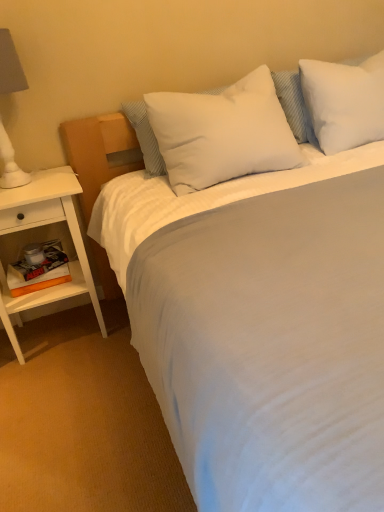
Measure the distance between white soft pillow at center, marked as the second pillow in a right-to-left arrangement, and camera.

4.92 feet.

What do you see at coordinates (44, 225) in the screenshot? The image size is (384, 512). I see `white wood nightstand at left` at bounding box center [44, 225].

In order to face white wood nightstand at left, should I rotate leftwards or rightwards?

Turn left approximately 19.790 degrees to face it.

You are a GUI agent. You are given a task and a screenshot of the screen. Output one action in this format:
    pyautogui.click(x=<x>, y=<y>)
    Task: Click on the orange matte book at left
    
    Given the screenshot: What is the action you would take?
    pos(39,271)

How much space does white soft pillow at upper right, which is the second pillow from left to right, occupy vertically?

14.94 inches.

Locate an element on the screen. The image size is (384, 512). white matte lampshade at left is located at coordinates (10, 66).

Can you confirm if white soft pillow at upper right, the 1th pillow from the right, is positioned to the right of white soft pillow at center, arranged as the first pillow when viewed from the left?

Indeed, white soft pillow at upper right, the 1th pillow from the right, is positioned on the right side of white soft pillow at center, arranged as the first pillow when viewed from the left.

Is white soft pillow at upper right, the 1th pillow from the right, positioned with its back to white soft pillow at center, arranged as the first pillow when viewed from the left?

white soft pillow at upper right, the 1th pillow from the right, does not have its back to white soft pillow at center, arranged as the first pillow when viewed from the left.

Where is `pillow behind the white soft pillow at center, arranged as the first pillow when viewed from the left`? pillow behind the white soft pillow at center, arranged as the first pillow when viewed from the left is located at coordinates (344, 102).

Considering the relative sizes of white wood nightstand at left and white soft pillow at center, marked as the second pillow in a right-to-left arrangement, in the image provided, is white wood nightstand at left smaller than white soft pillow at center, marked as the second pillow in a right-to-left arrangement,?

No, white wood nightstand at left is not smaller than white soft pillow at center, marked as the second pillow in a right-to-left arrangement.

Is white wood nightstand at left positioned far away from white soft pillow at center, marked as the second pillow in a right-to-left arrangement?

They are positioned close to each other.

Between point (53, 294) and point (245, 172), which one is positioned behind?

The point (53, 294) is behind.

Based on the photo, is white wood nightstand at left thinner than white soft pillow at center, arranged as the first pillow when viewed from the left?

No.

Considering the relative sizes of white wood nightstand at left and white soft pillow at upper right, the 1th pillow from the right, in the image provided, is white wood nightstand at left bigger than white soft pillow at upper right, the 1th pillow from the right,?

Indeed, white wood nightstand at left has a larger size compared to white soft pillow at upper right, the 1th pillow from the right.

Could you measure the distance between white wood nightstand at left and white soft pillow at upper right, the 1th pillow from the right?

white wood nightstand at left and white soft pillow at upper right, the 1th pillow from the right, are 3.79 feet apart.

Is white wood nightstand at left behind white soft pillow at upper right, which is the second pillow from left to right?

No, white wood nightstand at left is closer to the viewer.

Who is smaller, white matte lampshade at left or orange matte book at left?

Smaller between the two is orange matte book at left.

How much distance is there between white matte lampshade at left and orange matte book at left?

white matte lampshade at left and orange matte book at left are 17.57 inches apart from each other.

Considering the positions of objects white matte lampshade at left and orange matte book at left in the image provided, who is more to the right, white matte lampshade at left or orange matte book at left?

orange matte book at left is more to the right.

This screenshot has width=384, height=512. Find the location of `bedside lamp positioned vertically above the orange matte book at left (from a real-world perspective)`. bedside lamp positioned vertically above the orange matte book at left (from a real-world perspective) is located at coordinates (10, 66).

Is white soft pillow at center, marked as the second pillow in a right-to-left arrangement, at the back of orange matte book at left?

orange matte book at left does not have its back to white soft pillow at center, marked as the second pillow in a right-to-left arrangement.

Considering the positions of objects orange matte book at left and white soft pillow at center, arranged as the first pillow when viewed from the left, in the image provided, who is more to the left, orange matte book at left or white soft pillow at center, arranged as the first pillow when viewed from the left,?

orange matte book at left.

Based on the photo, can you confirm if orange matte book at left is wider than white soft pillow at center, arranged as the first pillow when viewed from the left?

No.

Considering the sizes of objects orange matte book at left and white matte lampshade at left in the image provided, who is thinner, orange matte book at left or white matte lampshade at left?

orange matte book at left is thinner.

How many degrees apart are the facing directions of orange matte book at left and white matte lampshade at left?

There is a 2.19-degree angle between the facing directions of orange matte book at left and white matte lampshade at left.

In order to click on book below the white matte lampshade at left (from a real-world perspective) in this screenshot , I will do `click(39, 271)`.

How much distance is there between orange matte book at left and white wood nightstand at left?

They are 6.05 inches apart.

Is orange matte book at left aimed at white wood nightstand at left?

Yes, orange matte book at left is oriented towards white wood nightstand at left.

Can you confirm if orange matte book at left is bigger than white wood nightstand at left?

→ No, orange matte book at left is not bigger than white wood nightstand at left.

Based on the photo, based on their positions, is orange matte book at left located to the left or right of white wood nightstand at left?

orange matte book at left is positioned on white wood nightstand at left's left side.

The width and height of the screenshot is (384, 512). I want to click on pillow in front of the white soft pillow at upper right, the 1th pillow from the right, so click(222, 133).

This screenshot has width=384, height=512. I want to click on nightstand below the white soft pillow at center, marked as the second pillow in a right-to-left arrangement (from the image's perspective), so click(x=44, y=225).

Based on their spatial positions, is white matte lampshade at left or white soft pillow at upper right, the 1th pillow from the right, closer to white wood nightstand at left?

white matte lampshade at left is closer to white wood nightstand at left.

From the image, which object appears to be farther from white soft pillow at upper right, which is the second pillow from left to right, orange matte book at left or white soft pillow at center, arranged as the first pillow when viewed from the left?

orange matte book at left is positioned further to the anchor white soft pillow at upper right, which is the second pillow from left to right.

From the image, which object appears to be farther from orange matte book at left, white wood nightstand at left or white matte lampshade at left?

white matte lampshade at left is positioned further to the anchor orange matte book at left.

Which object lies further to the anchor point white matte lampshade at left, white soft pillow at center, arranged as the first pillow when viewed from the left, or white wood nightstand at left?

white soft pillow at center, arranged as the first pillow when viewed from the left, lies further to white matte lampshade at left than the other object.

From the image, which object appears to be farther from white soft pillow at upper right, which is the second pillow from left to right, white wood nightstand at left or white matte lampshade at left?

white matte lampshade at left is further to white soft pillow at upper right, which is the second pillow from left to right.

Estimate the real-world distances between objects in this image. Which object is closer to white wood nightstand at left, white soft pillow at center, marked as the second pillow in a right-to-left arrangement, or orange matte book at left?

orange matte book at left.

Considering their positions, is white soft pillow at center, marked as the second pillow in a right-to-left arrangement, positioned further to white wood nightstand at left than white soft pillow at upper right, the 1th pillow from the right?

Based on the image, white soft pillow at upper right, the 1th pillow from the right, appears to be further to white wood nightstand at left.

Considering their positions, is orange matte book at left positioned closer to white soft pillow at upper right, the 1th pillow from the right, than white wood nightstand at left?

white wood nightstand at left lies closer to white soft pillow at upper right, the 1th pillow from the right, than the other object.

At what (x,y) coordinates should I click in order to perform the action: click on nightstand between orange matte book at left and white soft pillow at upper right, which is the second pillow from left to right, from left to right. Please return your answer as a coordinate pair (x, y). The image size is (384, 512). Looking at the image, I should click on 44,225.

The image size is (384, 512). I want to click on nightstand situated between white matte lampshade at left and white soft pillow at upper right, which is the second pillow from left to right, from left to right, so click(44, 225).

The height and width of the screenshot is (512, 384). Find the location of `book between white matte lampshade at left and white soft pillow at center, arranged as the first pillow when viewed from the left, in the horizontal direction`. book between white matte lampshade at left and white soft pillow at center, arranged as the first pillow when viewed from the left, in the horizontal direction is located at coordinates (39, 271).

The image size is (384, 512). I want to click on nightstand between white matte lampshade at left and white soft pillow at center, marked as the second pillow in a right-to-left arrangement, from left to right, so click(44, 225).